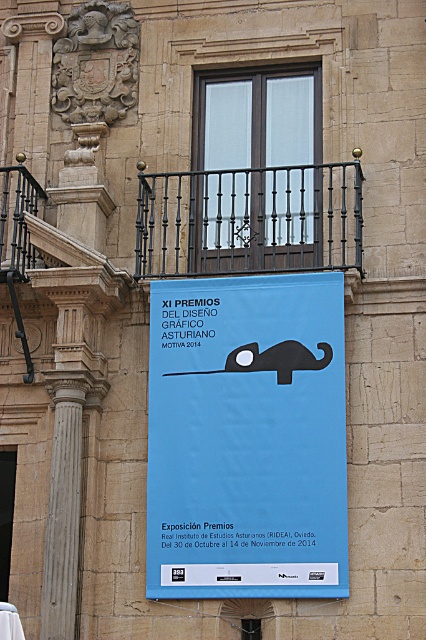
Question: Which object is closer to the camera taking this photo?

Choices:
 (A) blue paper poster at center
 (B) black wrought iron at upper center

Answer: (A)

Question: Can you confirm if blue paper poster at center is positioned to the left of black wrought iron at upper center?

Choices:
 (A) no
 (B) yes

Answer: (B)

Question: Among these points, which one is nearest to the camera?

Choices:
 (A) (296, 372)
 (B) (203, 252)

Answer: (A)

Question: Which point is farther from the camera taking this photo?

Choices:
 (A) (344, 262)
 (B) (250, 541)

Answer: (A)

Question: Is blue paper poster at center positioned in front of black wrought iron at upper center?

Choices:
 (A) no
 (B) yes

Answer: (B)

Question: Does blue paper poster at center have a greater width compared to black wrought iron at upper center?

Choices:
 (A) no
 (B) yes

Answer: (B)